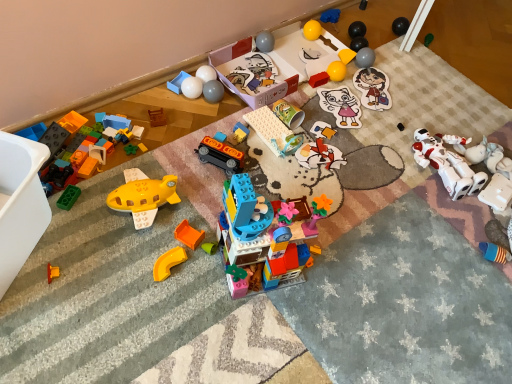
What is the approximate height of white plastic toy at lower right, the 25th toy from the left?

1.53 inches.

This screenshot has width=512, height=384. I want to click on yellow rubber ball at upper center, marked as the 16th toy in a left-to-right arrangement, so click(312, 30).

This screenshot has width=512, height=384. Describe the element at coordinates (312, 30) in the screenshot. I see `yellow rubber ball at upper center, the 11th toy when ordered from right to left` at that location.

The image size is (512, 384). Find the location of `matte gray spheres at upper center, which is the ninth toy from left to right`. matte gray spheres at upper center, which is the ninth toy from left to right is located at coordinates (213, 91).

The width and height of the screenshot is (512, 384). I want to click on matte plastic toy blocks at upper center, which is the 22th toy from right to left, so click(198, 85).

At what (x,y) coordinates should I click in order to perform the action: click on matte plastic train at center, which is the 11th toy in left-to-right order. Please return your answer as a coordinate pair (x, y). Looking at the image, I should click on (240, 133).

Considering the positions of objects orange plastic block at center, which is the eighth toy from left to right, and rubber yellow toy at lower left, arranged as the 26th toy when viewed from the right, in the image provided, who is more to the left, orange plastic block at center, which is the eighth toy from left to right, or rubber yellow toy at lower left, arranged as the 26th toy when viewed from the right,?

rubber yellow toy at lower left, arranged as the 26th toy when viewed from the right.

From the picture: From the image's perspective, is orange plastic block at center, which is the eighth toy from left to right, located above or below rubber yellow toy at lower left, arranged as the 26th toy when viewed from the right?

Based on their image positions, orange plastic block at center, which is the eighth toy from left to right, is located above rubber yellow toy at lower left, arranged as the 26th toy when viewed from the right.

Which of these two, orange plastic block at center, which is the eighth toy from left to right, or rubber yellow toy at lower left, arranged as the 26th toy when viewed from the right, is thinner?

With smaller width is rubber yellow toy at lower left, arranged as the 26th toy when viewed from the right.

Is orange plastic block at center, which is the eighth toy from left to right, facing towards rubber yellow toy at lower left, arranged as the 26th toy when viewed from the right?

No, orange plastic block at center, which is the eighth toy from left to right, is not turned towards rubber yellow toy at lower left, arranged as the 26th toy when viewed from the right.

Which of these two, black plastic train at center, positioned as the tenth toy in left-to-right order, or rubber yellow toy at lower left, placed as the first toy when sorted from left to right, stands taller?

black plastic train at center, positioned as the tenth toy in left-to-right order, is taller.

Looking at this image, from a real-world perspective, who is located higher, black plastic train at center, positioned as the tenth toy in left-to-right order, or rubber yellow toy at lower left, placed as the first toy when sorted from left to right?

black plastic train at center, positioned as the tenth toy in left-to-right order, from a real-world perspective.

Between black plastic train at center, which is the 17th toy from right to left, and rubber yellow toy at lower left, arranged as the 26th toy when viewed from the right, which one has smaller width?

With smaller width is rubber yellow toy at lower left, arranged as the 26th toy when viewed from the right.

Considering the positions of objects black plastic train at center, which is the 17th toy from right to left, and rubber yellow toy at lower left, arranged as the 26th toy when viewed from the right, in the image provided, who is behind, black plastic train at center, which is the 17th toy from right to left, or rubber yellow toy at lower left, arranged as the 26th toy when viewed from the right,?

black plastic train at center, which is the 17th toy from right to left, is further away from the camera.

Looking at this image, considering the relative sizes of black plastic train at center, which is the 17th toy from right to left, and wooden block at center, which is counted as the third toy, starting from the left, in the image provided, is black plastic train at center, which is the 17th toy from right to left, shorter than wooden block at center, which is counted as the third toy, starting from the left,?

Incorrect, the height of black plastic train at center, which is the 17th toy from right to left, does not fall short of that of wooden block at center, which is counted as the third toy, starting from the left.

Considering the relative sizes of black plastic train at center, positioned as the tenth toy in left-to-right order, and wooden block at center, which is counted as the third toy, starting from the left, in the image provided, is black plastic train at center, positioned as the tenth toy in left-to-right order, thinner than wooden block at center, which is counted as the third toy, starting from the left,?

In fact, black plastic train at center, positioned as the tenth toy in left-to-right order, might be wider than wooden block at center, which is counted as the third toy, starting from the left.

From a real-world perspective, count 19th toys downward from the black plastic train at center, which is the 17th toy from right to left, and point to it. Please provide its 2D coordinates.

[(157, 117)]

Considering the relative positions of black plastic train at center, which is the 17th toy from right to left, and wooden block at center, which is counted as the third toy, starting from the left, in the image provided, is black plastic train at center, which is the 17th toy from right to left, in front of wooden block at center, which is counted as the third toy, starting from the left,?

Yes, the depth of black plastic train at center, which is the 17th toy from right to left, is less than that of wooden block at center, which is counted as the third toy, starting from the left.

From a real-world perspective, does shiny metallic ball at upper center, positioned as the seventh toy in right-to-left order, stand above matte white cat at center, which is the tenth toy from right to left?

Yes, from a real-world perspective, shiny metallic ball at upper center, positioned as the seventh toy in right-to-left order, is above matte white cat at center, which is the tenth toy from right to left.

Between shiny metallic ball at upper center, the twentieth toy positioned from the left, and matte white cat at center, which is the tenth toy from right to left, which one has more height?

Standing taller between the two is shiny metallic ball at upper center, the twentieth toy positioned from the left.

Find the location of a particular element. the 3rd toy to the left of the shiny metallic ball at upper center, positioned as the seventh toy in right-to-left order, counting from the anchor's position is located at coordinates (341, 106).

I want to click on toy that is the 1st one above the white plastic toy at lower right, the 25th toy from the left (from a real-world perspective), so click(x=346, y=55).

Is white plastic toy at lower right, positioned as the second toy in right-to-left order, turned away from yellow matte square at upper center, acting as the eighth toy starting from the right?

white plastic toy at lower right, positioned as the second toy in right-to-left order, is not turned away from yellow matte square at upper center, acting as the eighth toy starting from the right.

Is point (500, 179) closer or farther from the camera than point (355, 52)?

Point (500, 179) is positioned closer to the camera compared to point (355, 52).

Considering the relative sizes of white plastic toy at lower right, positioned as the second toy in right-to-left order, and yellow matte square at upper center, which is the 19th toy in left-to-right order, in the image provided, is white plastic toy at lower right, positioned as the second toy in right-to-left order, shorter than yellow matte square at upper center, which is the 19th toy in left-to-right order,?

No, white plastic toy at lower right, positioned as the second toy in right-to-left order, is not shorter than yellow matte square at upper center, which is the 19th toy in left-to-right order.

Between white glossy balls at upper center, which is the seventh toy in left-to-right order, and yellow plastic curve at lower left, which is the 21th toy from right to left, which one has more height?

white glossy balls at upper center, which is the seventh toy in left-to-right order, is taller.

Is white glossy balls at upper center, marked as the twentieth toy in a right-to-left arrangement, oriented away from yellow plastic curve at lower left, which ranks as the 6th toy in left-to-right order?

No.

Looking at this image, which object is closer to the camera taking this photo, white glossy balls at upper center, which is the seventh toy in left-to-right order, or yellow plastic curve at lower left, which ranks as the 6th toy in left-to-right order?

yellow plastic curve at lower left, which ranks as the 6th toy in left-to-right order, is closer to the camera.

Which is in front, matte plastic toy blocks at upper center, which is the 22th toy from right to left, or matte plastic train at center, which is the 11th toy in left-to-right order?

matte plastic train at center, which is the 11th toy in left-to-right order, is more forward.

Who is smaller, matte plastic toy blocks at upper center, which is the 22th toy from right to left, or matte plastic train at center, the sixteenth toy when ordered from right to left?

matte plastic train at center, the sixteenth toy when ordered from right to left, is smaller.

Is matte plastic train at center, which is the 11th toy in left-to-right order, at the back of matte plastic toy blocks at upper center, which ranks as the 5th toy in left-to-right order?

No, matte plastic train at center, which is the 11th toy in left-to-right order, is not at the back of matte plastic toy blocks at upper center, which ranks as the 5th toy in left-to-right order.

Does matte plastic toy blocks at upper center, which ranks as the 5th toy in left-to-right order, have a greater width compared to matte plastic train at center, which is the 11th toy in left-to-right order?

Indeed, matte plastic toy blocks at upper center, which ranks as the 5th toy in left-to-right order, has a greater width compared to matte plastic train at center, which is the 11th toy in left-to-right order.

From the rubber yellow toy at lower left, placed as the first toy when sorted from left to right, count 2nd toys backward and point to it. Please provide its 2D coordinates.

[(188, 235)]

Find the location of a particular element. the 9th toy counting from the left side of the black plastic train at center, which is the 17th toy from right to left is located at coordinates (52, 272).

Which object lies nearer to the anchor point matte plastic toy blocks at upper center, which ranks as the 5th toy in left-to-right order, wooden block at center, which is counted as the third toy, starting from the left, or matte gray spheres at upper center, the eighteenth toy in the right-to-left sequence?

Among the two, matte gray spheres at upper center, the eighteenth toy in the right-to-left sequence, is located nearer to matte plastic toy blocks at upper center, which ranks as the 5th toy in left-to-right order.

From the image, which object appears to be farther from matte plastic toy blocks at upper center, which ranks as the 5th toy in left-to-right order, shiny metallic ball at upper center, the twentieth toy positioned from the left, or matte black block at upper center, the 5th toy viewed from the right?

matte black block at upper center, the 5th toy viewed from the right, is further to matte plastic toy blocks at upper center, which ranks as the 5th toy in left-to-right order.

Consider the image. When comparing their distances from wooden block at center, the 24th toy from the right, does matte plastic train at center, which is the 11th toy in left-to-right order, or matte cardboard puzzle piece at center, which is counted as the 12th toy, starting from the right, seem further?

matte cardboard puzzle piece at center, which is counted as the 12th toy, starting from the right, is positioned further to the anchor wooden block at center, the 24th toy from the right.

Based on their spatial positions, is green matte toy at center-left, acting as the second toy starting from the left, or rubber yellow toy at lower left, arranged as the 26th toy when viewed from the right, further from matte white cat at center, placed as the seventeenth toy when sorted from left to right?

rubber yellow toy at lower left, arranged as the 26th toy when viewed from the right, is positioned further to the anchor matte white cat at center, placed as the seventeenth toy when sorted from left to right.

Estimate the real-world distances between objects in this image. Which object is closer to shiny metallic ball at upper center, positioned as the seventh toy in right-to-left order, matte plastic cup at center, positioned as the fourteenth toy in right-to-left order, or matte cardboard cup at center, the 13th toy in the right-to-left sequence?

matte cardboard cup at center, the 13th toy in the right-to-left sequence, lies closer to shiny metallic ball at upper center, positioned as the seventh toy in right-to-left order, than the other object.

Estimate the real-world distances between objects in this image. Which object is further from white plastic toy at lower right, the 25th toy from the left, brick-like plastic building at center, placed as the fifteenth toy when sorted from right to left, or cardboard box at center?

Based on the image, cardboard box at center appears to be further to white plastic toy at lower right, the 25th toy from the left.

Which object lies further to the anchor point rubber yellow toy at lower left, placed as the first toy when sorted from left to right, matte plastic character at upper right, placed as the 6th toy when sorted from right to left, or yellow plastic curve at lower left, which ranks as the 6th toy in left-to-right order?

matte plastic character at upper right, placed as the 6th toy when sorted from right to left, lies further to rubber yellow toy at lower left, placed as the first toy when sorted from left to right, than the other object.

Looking at the image, which one is located closer to matte plastic toy blocks at upper center, which is the 22th toy from right to left, white glossy balls at upper center, which is the seventh toy in left-to-right order, or wooden block at center, which is counted as the third toy, starting from the left?

white glossy balls at upper center, which is the seventh toy in left-to-right order, lies closer to matte plastic toy blocks at upper center, which is the 22th toy from right to left, than the other object.

The height and width of the screenshot is (384, 512). I want to click on box between matte plastic train at center, which is the 11th toy in left-to-right order, and shiny metallic ball at upper center, the twentieth toy positioned from the left, so click(x=253, y=73).

Locate an element on the screen. The width and height of the screenshot is (512, 384). box between orange plastic block at center, acting as the nineteenth toy starting from the right, and blue rubber toy at lower right, the 24th toy positioned from the left, from left to right is located at coordinates (253, 73).

Find the location of a particular element. box located between wooden block at center, the 24th toy from the right, and matte plastic character at upper right, placed as the 21th toy when sorted from left to right, in the left-right direction is located at coordinates (253, 73).

The height and width of the screenshot is (384, 512). I want to click on box between yellow rubber ball at upper center, marked as the 16th toy in a left-to-right arrangement, and matte white cat at center, which is the tenth toy from right to left, from top to bottom, so click(x=253, y=73).